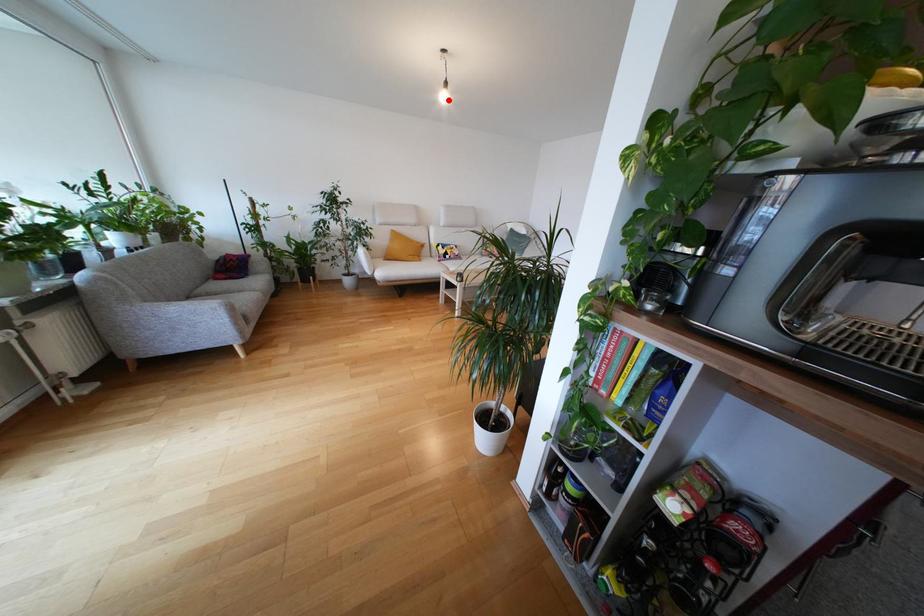
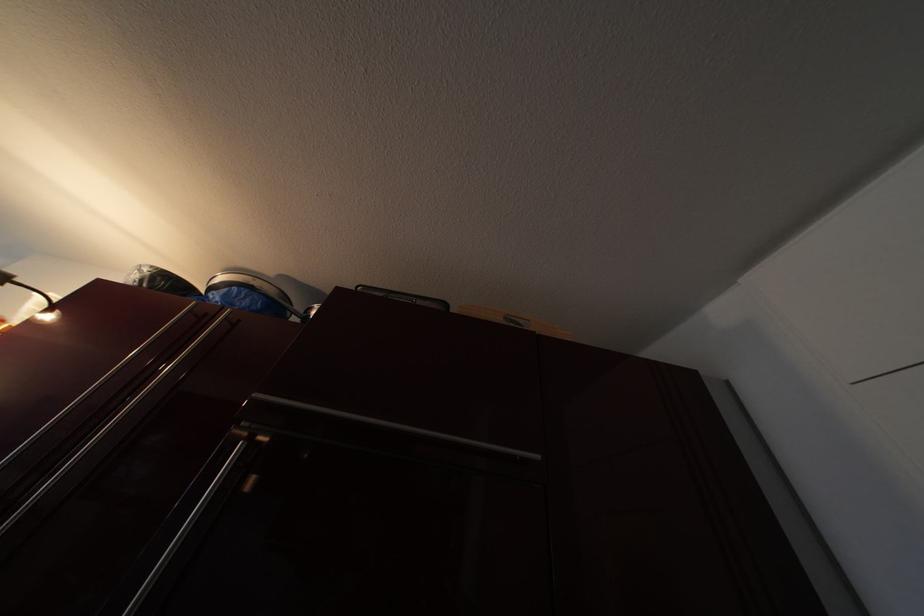
Question: I am providing you with two images of the same scene from different viewpoints. A red point is marked on the first image. At the location where the point appears in image 1, is it still visible in image 2?

Choices:
 (A) Yes
 (B) No

Answer: (B)